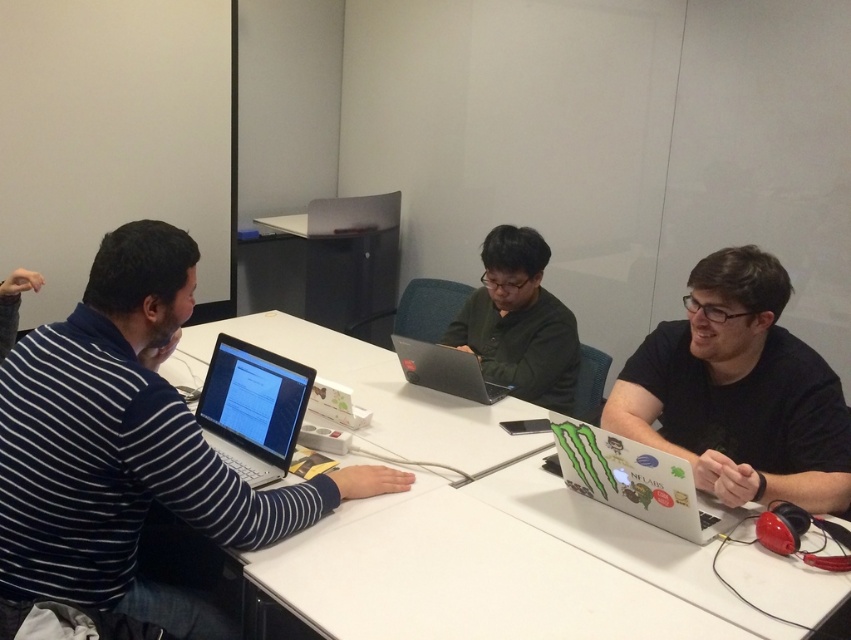
Is silver metallic laptop at left above glossy black laptop at center?

Actually, silver metallic laptop at left is below glossy black laptop at center.

Consider the image. How far apart are silver metallic laptop at left and glossy black laptop at center?

silver metallic laptop at left is 25.40 inches away from glossy black laptop at center.

Does point (254, 445) come closer to viewer compared to point (469, 381)?

Yes, it is.

The image size is (851, 640). I want to click on silver metallic laptop at left, so click(253, 408).

Based on the photo, between striped fabric shirt at left and matte black shirt at right, which one appears on the right side from the viewer's perspective?

matte black shirt at right

From the picture: Does striped fabric shirt at left come behind matte black shirt at right?

No, it is in front of matte black shirt at right.

The height and width of the screenshot is (640, 851). What do you see at coordinates (129, 445) in the screenshot?
I see `striped fabric shirt at left` at bounding box center [129, 445].

Identify the location of striped fabric shirt at left. The width and height of the screenshot is (851, 640). (129, 445).

Who is taller, green matte jacket at center or white glossy laptop at right?

green matte jacket at center is taller.

Locate an element on the screen. The height and width of the screenshot is (640, 851). green matte jacket at center is located at coordinates (518, 323).